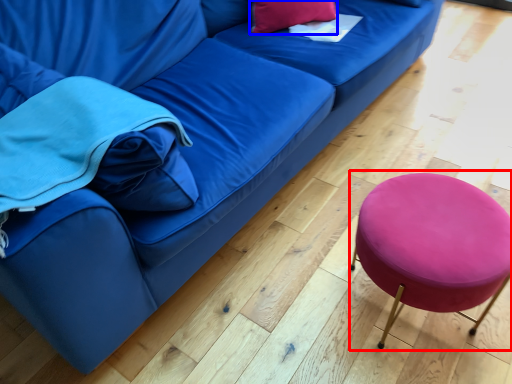
Question: Which object is further to the camera taking this photo, bar stool (highlighted by a red box) or pillow (highlighted by a blue box)?

Choices:
 (A) bar stool
 (B) pillow

Answer: (B)